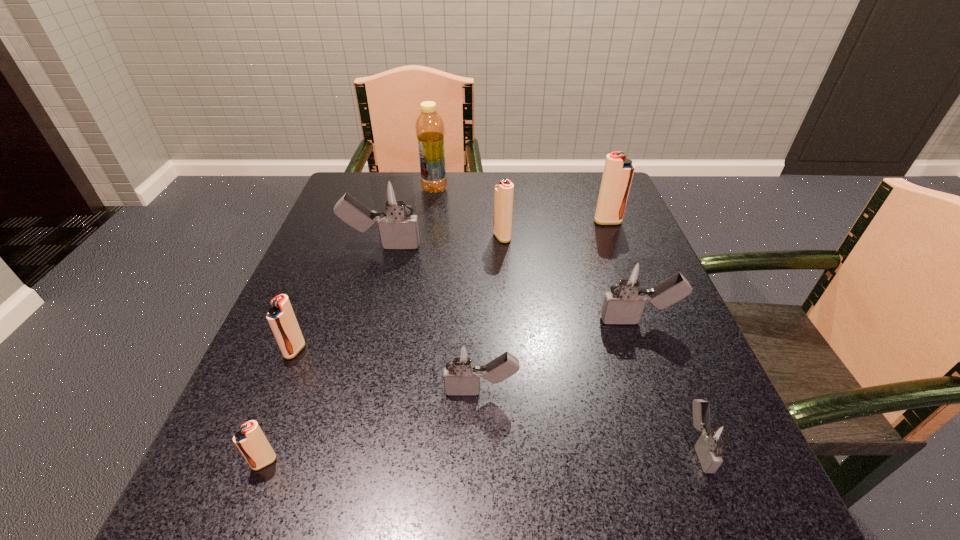
You are a GUI agent. You are given a task and a screenshot of the screen. Output one action in this format:
    pyautogui.click(x=<x>, y=<y>)
    Task: Click on the second nearest gray igniter
    
    Given the screenshot: What is the action you would take?
    pyautogui.click(x=462, y=366)

Locate an element on the screen. The width and height of the screenshot is (960, 540). the second gray igniter from left to right is located at coordinates (462, 366).

At what (x,y) coordinates should I click in order to perform the action: click on the third farthest red igniter. Please return your answer as a coordinate pair (x, y). Image resolution: width=960 pixels, height=540 pixels. Looking at the image, I should click on (281, 318).

The width and height of the screenshot is (960, 540). What are the coordinates of `the fifth farthest igniter` in the screenshot? It's located at (281, 318).

Locate an element on the screen. The height and width of the screenshot is (540, 960). the smallest red igniter is located at coordinates point(250,440).

The image size is (960, 540). In order to click on the nearest gray igniter in this screenshot , I will do `click(716, 436)`.

Locate an element on the screen. The image size is (960, 540). free space located on the left of the tallest object is located at coordinates (366, 189).

Find the location of `free space located 0.130m on the front of the biggest red igniter`. free space located 0.130m on the front of the biggest red igniter is located at coordinates (622, 260).

Locate an element on the screen. Image resolution: width=960 pixels, height=540 pixels. free space located 0.180m on the back of the leftmost gray igniter is located at coordinates (396, 194).

Where is `free space located 0.100m on the right of the second red igniter from right to left`? The image size is (960, 540). free space located 0.100m on the right of the second red igniter from right to left is located at coordinates (554, 237).